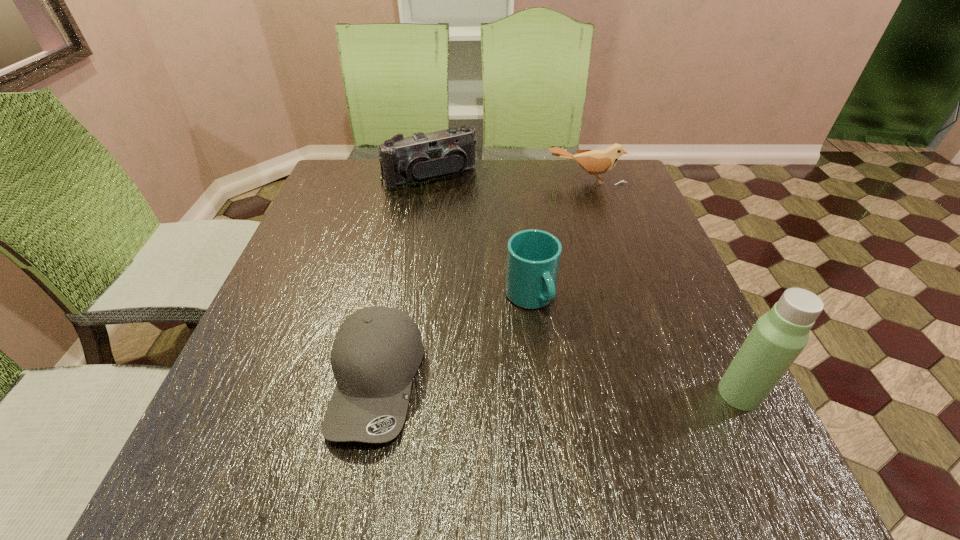
You are a GUI agent. You are given a task and a screenshot of the screen. Output one action in this format:
    pyautogui.click(x=<x>, y=<y>)
    Task: Click on the vacant area situated 0.230m at the beak of the bird
    This screenshot has width=960, height=540.
    Given the screenshot: What is the action you would take?
    pyautogui.click(x=578, y=236)

Image resolution: width=960 pixels, height=540 pixels. Identify the location of free point located 0.110m at the beak of the bird. (580, 209).

This screenshot has width=960, height=540. I want to click on free region located 0.330m at the beak of the bird, so click(577, 262).

The height and width of the screenshot is (540, 960). In order to click on vacant space situated on the handle side of the cup in this screenshot , I will do `click(597, 401)`.

Find the location of a particular element. The height and width of the screenshot is (540, 960). vacant space located on the handle side of the cup is located at coordinates (603, 411).

The height and width of the screenshot is (540, 960). Find the location of `vacant point located on the handle side of the cup`. vacant point located on the handle side of the cup is located at coordinates (607, 416).

At what (x,y) coordinates should I click in order to perform the action: click on camcorder situated at the far edge. Please return your answer as a coordinate pair (x, y). This screenshot has width=960, height=540. Looking at the image, I should click on (x=420, y=157).

The width and height of the screenshot is (960, 540). I want to click on bird present at the far edge, so click(x=595, y=162).

Identify the location of baseball cap that is positioned at the near edge. (377, 350).

Where is `thermos bottle at the near edge`? This screenshot has width=960, height=540. thermos bottle at the near edge is located at coordinates (778, 337).